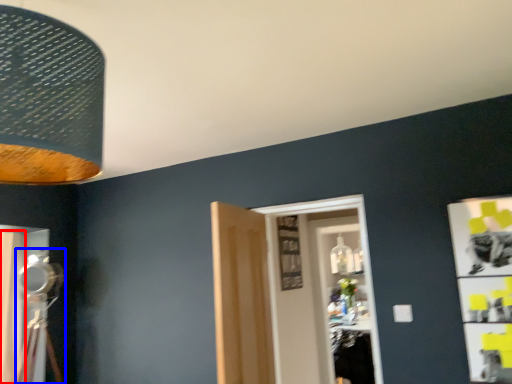
Question: Among these objects, which one is nearest to the camera, curtain (highlighted by a red box) or table lamp (highlighted by a blue box)?

Choices:
 (A) curtain
 (B) table lamp

Answer: (B)